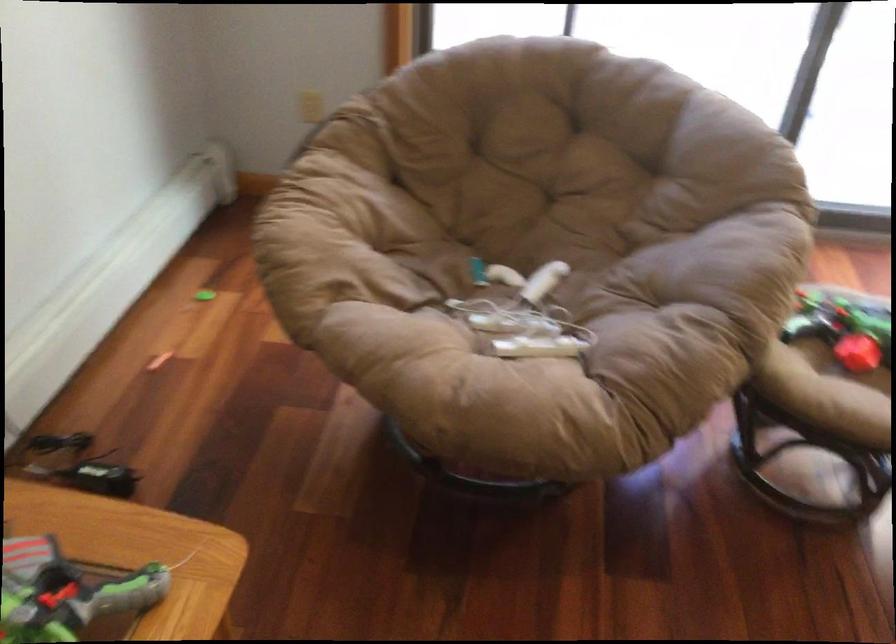
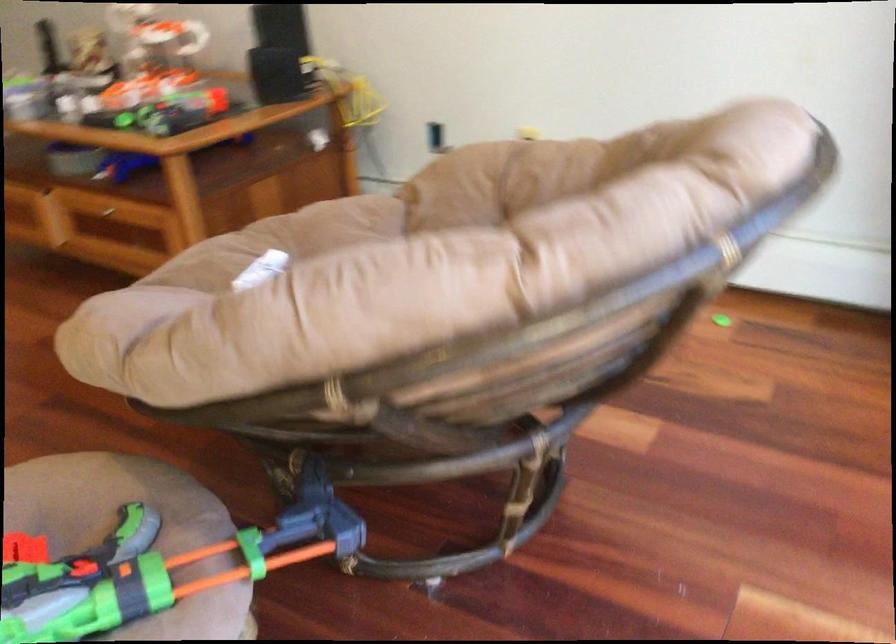
Find the pixel in the second image that matches (806,285) in the first image.

(159, 567)